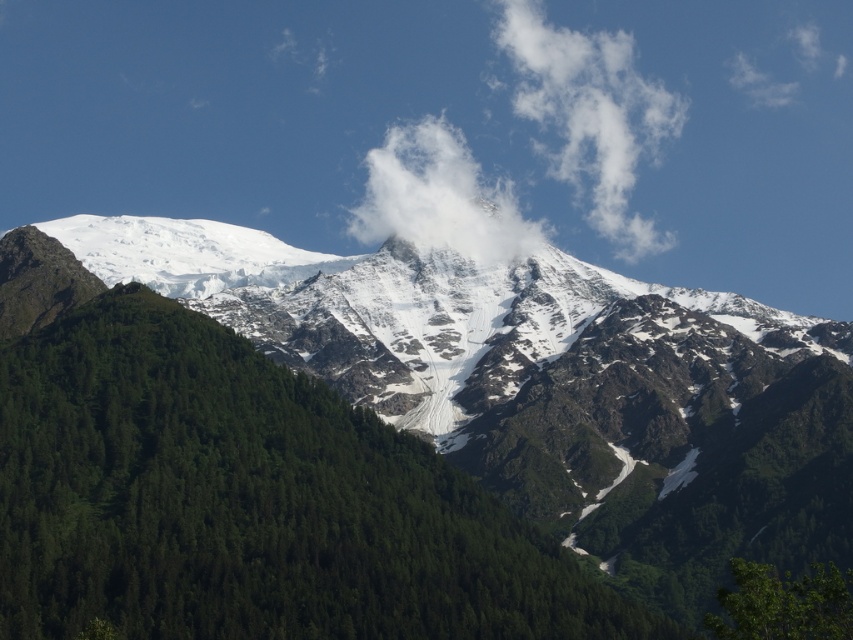
Is point (368, 179) behind point (792, 593)?

Yes, it is.

Can you confirm if white fluffy cloud at center is positioned to the left of green leafy tree at lower right?

Indeed, white fluffy cloud at center is positioned on the left side of green leafy tree at lower right.

At what (x,y) coordinates should I click in order to perform the action: click on white fluffy cloud at center. Please return your answer as a coordinate pair (x, y). This screenshot has height=640, width=853. Looking at the image, I should click on (439, 196).

Image resolution: width=853 pixels, height=640 pixels. Identify the location of white fluffy cloud at center. point(439,196).

Does white fluffy cloud at upper center appear over white snow at left?

Indeed, white fluffy cloud at upper center is positioned over white snow at left.

Can you confirm if white fluffy cloud at upper center is positioned below white snow at left?

No.

Where is `white fluffy cloud at upper center`? white fluffy cloud at upper center is located at coordinates (590, 116).

In the scene shown: Who is positioned more to the left, white fluffy cloud at upper center or white fluffy cloud at center?

From the viewer's perspective, white fluffy cloud at center appears more on the left side.

Which is more to the right, white fluffy cloud at upper center or white fluffy cloud at center?

white fluffy cloud at upper center

Is point (564, 36) more distant than point (442, 148)?

Yes.

The image size is (853, 640). Identify the location of white fluffy cloud at upper center. (590, 116).